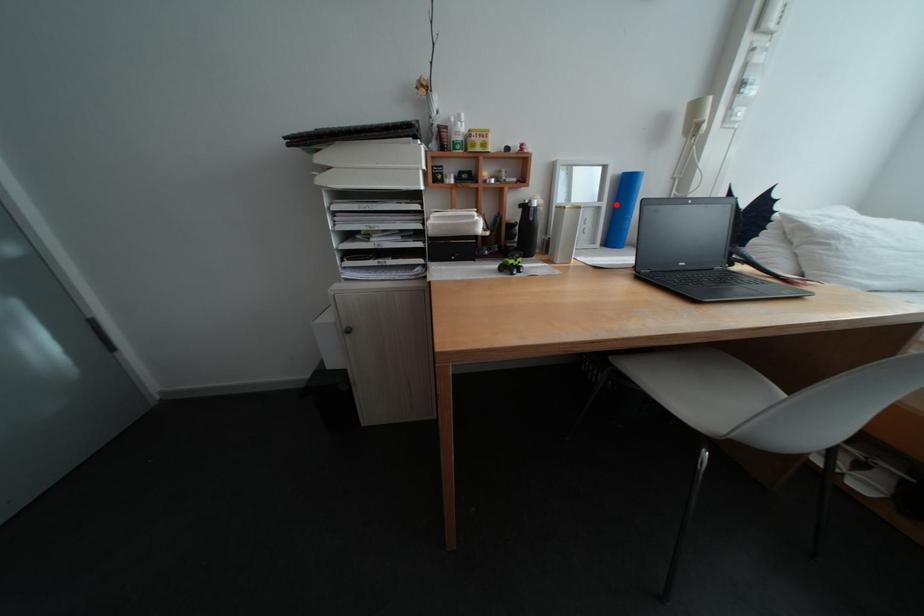
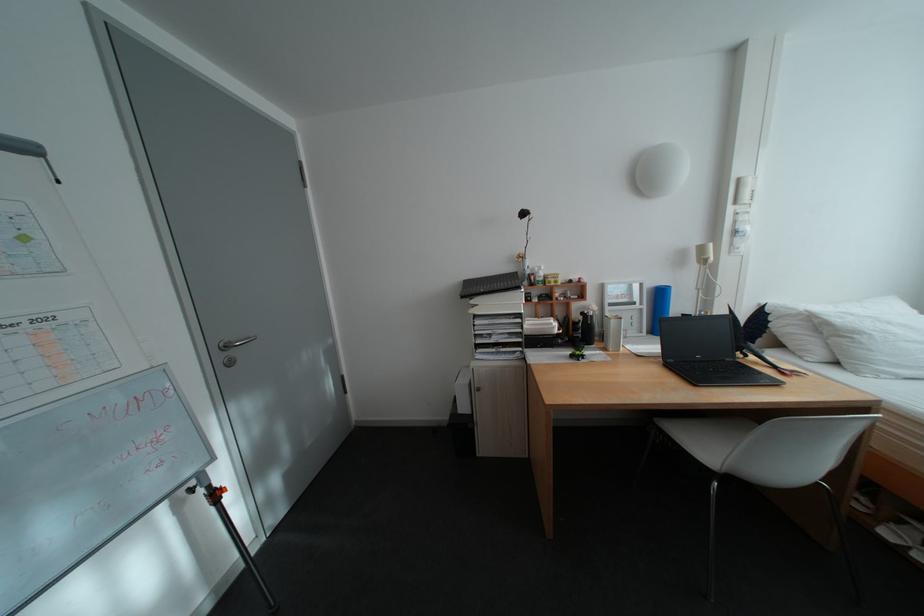
Locate, in the second image, the point that corresponds to the highlighted location in the first image.

(657, 307)